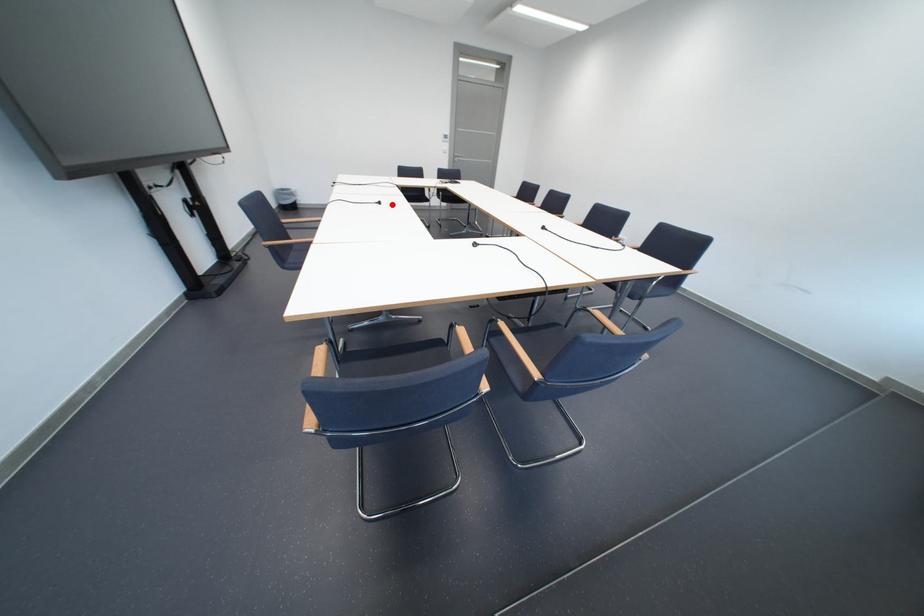
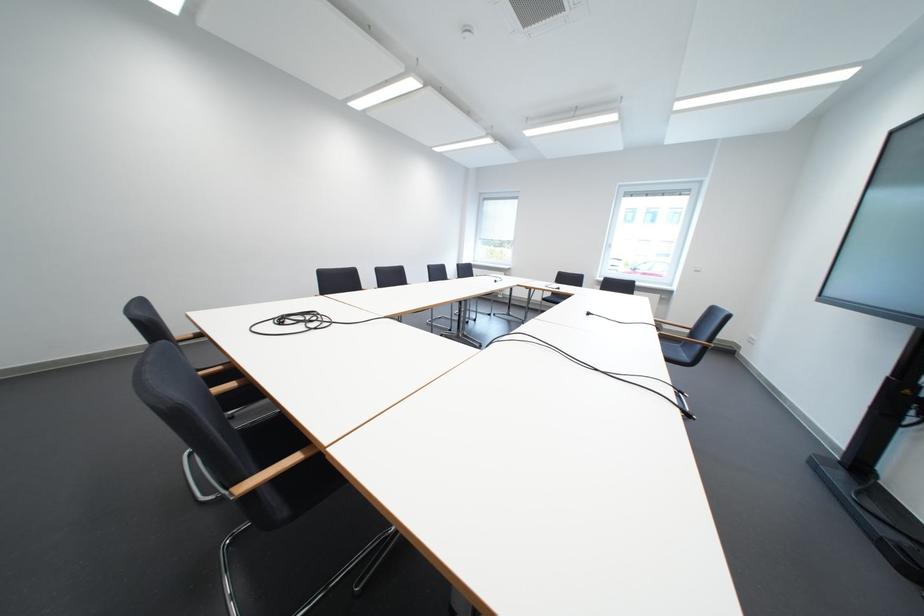
Question: I am providing you with two images of the same scene from different viewpoints. In image1, a red point is highlighted. Considering the same 3D point in image2, which of the following is correct?

Choices:
 (A) It is closer
 (B) It is farther

Answer: (A)